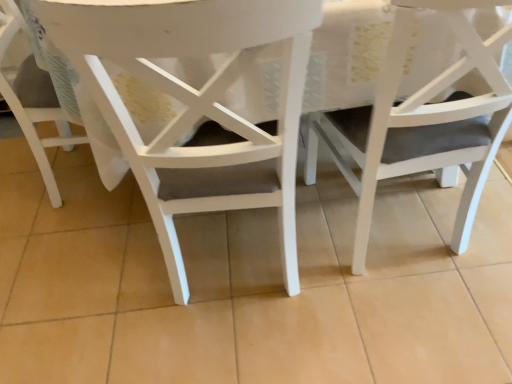
Question: Is white matte chair at center, the second chair from the right, outside of matte white chair at center, which is counted as the 1th chair, starting from the right?

Choices:
 (A) yes
 (B) no

Answer: (A)

Question: From the image's perspective, is white matte chair at center, which appears as the second chair when viewed from the left, located above matte white chair at center, the 3th chair from the left?

Choices:
 (A) yes
 (B) no

Answer: (B)

Question: Can you confirm if white matte chair at center, the second chair from the right, is taller than matte white chair at center, which is counted as the 1th chair, starting from the right?

Choices:
 (A) no
 (B) yes

Answer: (B)

Question: Is white matte chair at center, which appears as the second chair when viewed from the left, positioned behind matte white chair at center, the 3th chair from the left?

Choices:
 (A) no
 (B) yes

Answer: (A)

Question: Are white matte chair at center, which appears as the second chair when viewed from the left, and matte white chair at center, the 3th chair from the left, located far from each other?

Choices:
 (A) no
 (B) yes

Answer: (A)

Question: Considering the relative sizes of white matte chair at center, which appears as the second chair when viewed from the left, and matte white chair at center, which is counted as the 1th chair, starting from the right, in the image provided, is white matte chair at center, which appears as the second chair when viewed from the left, shorter than matte white chair at center, which is counted as the 1th chair, starting from the right,?

Choices:
 (A) no
 (B) yes

Answer: (A)

Question: From a real-world perspective, is white matte chair at lower left, which is the first chair in left-to-right order, located beneath matte white chair at center, the 3th chair from the left?

Choices:
 (A) yes
 (B) no

Answer: (A)

Question: Is white matte chair at lower left, which is the first chair in left-to-right order, thinner than matte white chair at center, which is counted as the 1th chair, starting from the right?

Choices:
 (A) yes
 (B) no

Answer: (A)

Question: From a real-world perspective, is white matte chair at lower left, marked as the third chair in a right-to-left arrangement, physically above matte white chair at center, which is counted as the 1th chair, starting from the right?

Choices:
 (A) no
 (B) yes

Answer: (A)

Question: Is white matte chair at lower left, which is the first chair in left-to-right order, at the right side of matte white chair at center, the 3th chair from the left?

Choices:
 (A) yes
 (B) no

Answer: (B)

Question: Is white matte chair at lower left, which is the first chair in left-to-right order, taller than matte white chair at center, the 3th chair from the left?

Choices:
 (A) no
 (B) yes

Answer: (A)

Question: Is white matte chair at lower left, which is the first chair in left-to-right order, looking in the opposite direction of matte white chair at center, which is counted as the 1th chair, starting from the right?

Choices:
 (A) yes
 (B) no

Answer: (B)

Question: Can you confirm if white matte chair at lower left, marked as the third chair in a right-to-left arrangement, is positioned to the left of white matte chair at center, which appears as the second chair when viewed from the left?

Choices:
 (A) yes
 (B) no

Answer: (A)